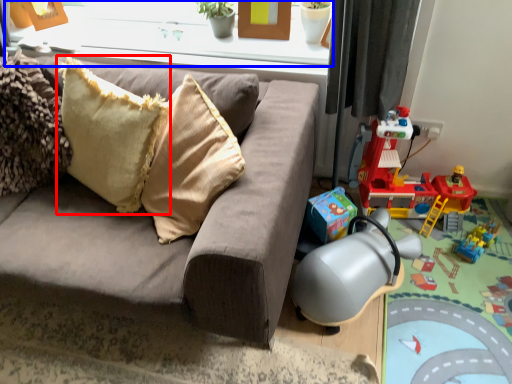
Question: Which of the following is the farthest to the observer, pillow (highlighted by a red box) or window frame (highlighted by a blue box)?

Choices:
 (A) pillow
 (B) window frame

Answer: (B)